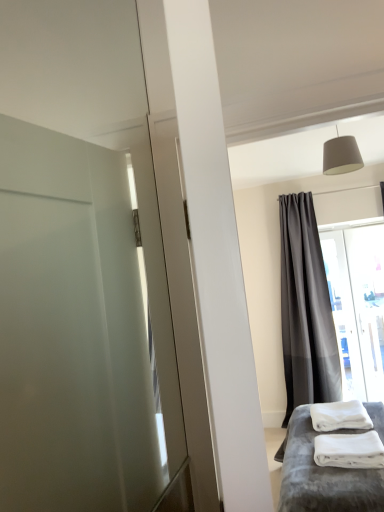
Question: Would you say white plush bed at lower right is to the left or to the right of dark gray sheer curtain at upper right in the picture?

Choices:
 (A) left
 (B) right

Answer: (A)

Question: From the image's perspective, is white plush bed at lower right above or below dark gray sheer curtain at upper right?

Choices:
 (A) below
 (B) above

Answer: (A)

Question: Estimate the real-world distances between objects in this image. Which object is closer to the transparent glass window at right?

Choices:
 (A) white fluffy bath towel at lower right
 (B) dark gray sheer curtain at upper right
 (C) white soft towels at lower right
 (D) white plush bed at lower right
 (E) matte gray lampshade at upper center

Answer: (B)

Question: Which object is positioned closest to the white fluffy bath towel at lower right?

Choices:
 (A) matte gray lampshade at upper center
 (B) white soft towels at lower right
 (C) dark gray sheer curtain at upper right
 (D) white plush bed at lower right
 (E) transparent glass window at right

Answer: (D)